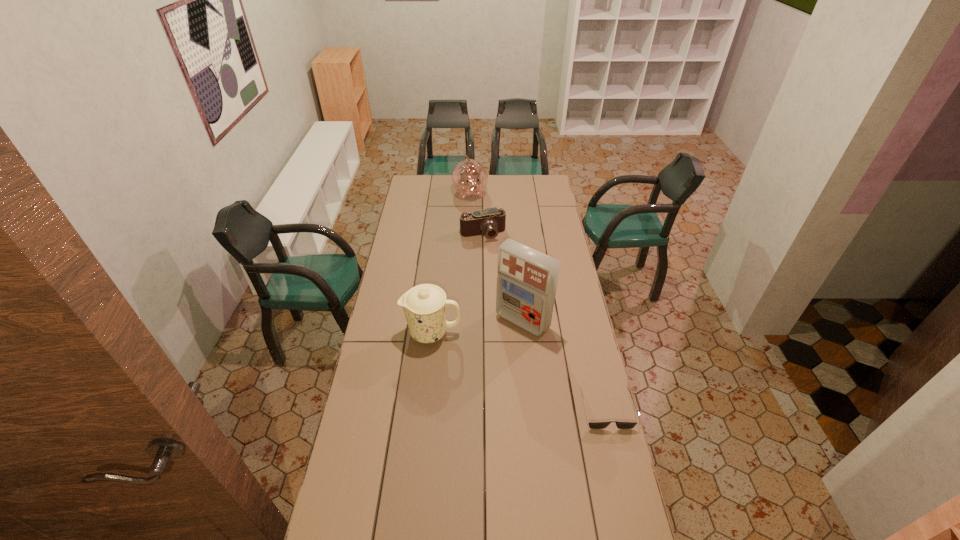
I want to click on vacant spot on the desktop that is between the chinaware and the sunglasses and is positioned on the front facing side of the farthest object, so click(x=536, y=379).

Identify the location of vacant space on the desktop that is between the chinaware and the nearest object and is positioned on the front-facing side of the tallest object. (489, 358).

At what (x,y) coordinates should I click in order to perform the action: click on free space on the desktop that is between the chinaware and the shortest object and is positioned on the front-facing side of the camera. Please return your answer as a coordinate pair (x, y). Looking at the image, I should click on (539, 380).